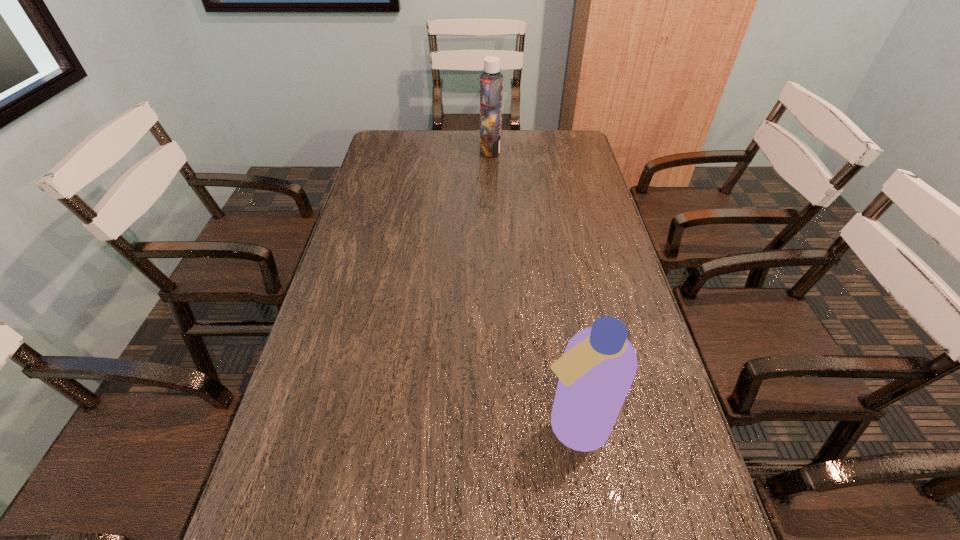
Locate an element on the screen. The height and width of the screenshot is (540, 960). vacant area that satisfies the following two spatial constraints: 1. on the front label of the farthest object; 2. on the left side of the right shampoo is located at coordinates (499, 426).

Find the location of a particular element. Image resolution: width=960 pixels, height=540 pixels. vacant point that satisfies the following two spatial constraints: 1. on the front label of the second object from right to left; 2. on the right side of the second nearest object is located at coordinates (499, 426).

Where is `free space that satisfies the following two spatial constraints: 1. on the back side of the nearer shampoo; 2. on the front label of the farther shampoo`? The height and width of the screenshot is (540, 960). free space that satisfies the following two spatial constraints: 1. on the back side of the nearer shampoo; 2. on the front label of the farther shampoo is located at coordinates (529, 150).

In order to click on vacant space that satisfies the following two spatial constraints: 1. on the front label of the nearer shampoo; 2. on the right side of the farther shampoo in this screenshot , I will do `click(499, 426)`.